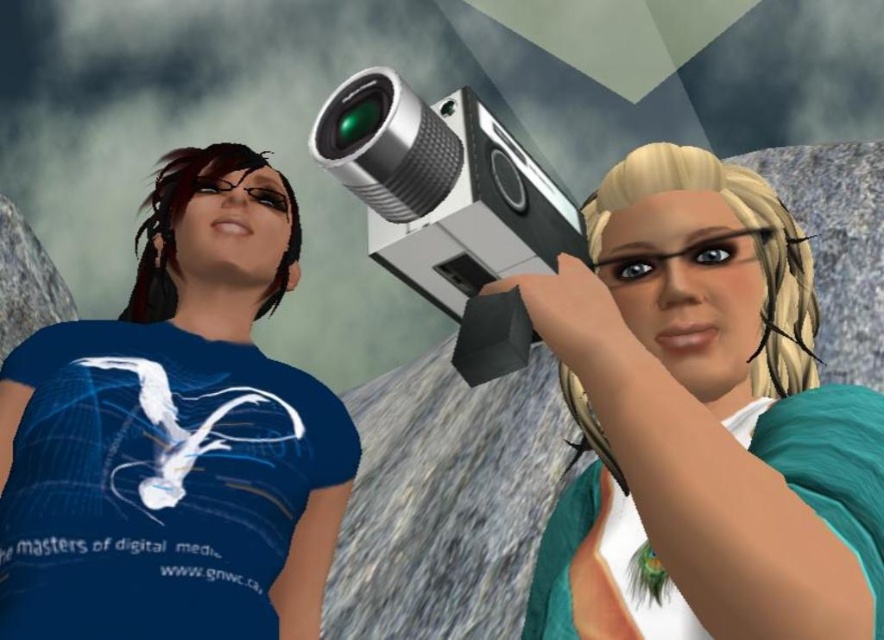
Can you confirm if blue matte t-shirt at left is bigger than metallic silver video camera at center?

Indeed, blue matte t-shirt at left has a larger size compared to metallic silver video camera at center.

Which is more to the left, blue matte t-shirt at left or metallic silver video camera at center?

Positioned to the left is blue matte t-shirt at left.

Between point (52, 499) and point (385, 131), which one is positioned in front?

Point (385, 131)

Where is `blue matte t-shirt at left`? This screenshot has height=640, width=884. blue matte t-shirt at left is located at coordinates (174, 436).

Can you confirm if shiny silver camera at center is smaller than metallic silver video camera at center?

No.

Does point (814, 403) lie in front of point (459, 252)?

That is True.

The width and height of the screenshot is (884, 640). In order to click on shiny silver camera at center in this screenshot , I will do `click(703, 422)`.

At what (x,y) coordinates should I click in order to perform the action: click on shiny silver camera at center. Please return your answer as a coordinate pair (x, y). This screenshot has width=884, height=640. Looking at the image, I should click on (703, 422).

Is the position of shiny silver camera at center more distant than that of blue matte t-shirt at left?

No.

Where is `shiny silver camera at center`? The width and height of the screenshot is (884, 640). shiny silver camera at center is located at coordinates (703, 422).

Find the location of a particular element. Image resolution: width=884 pixels, height=640 pixels. shiny silver camera at center is located at coordinates (703, 422).